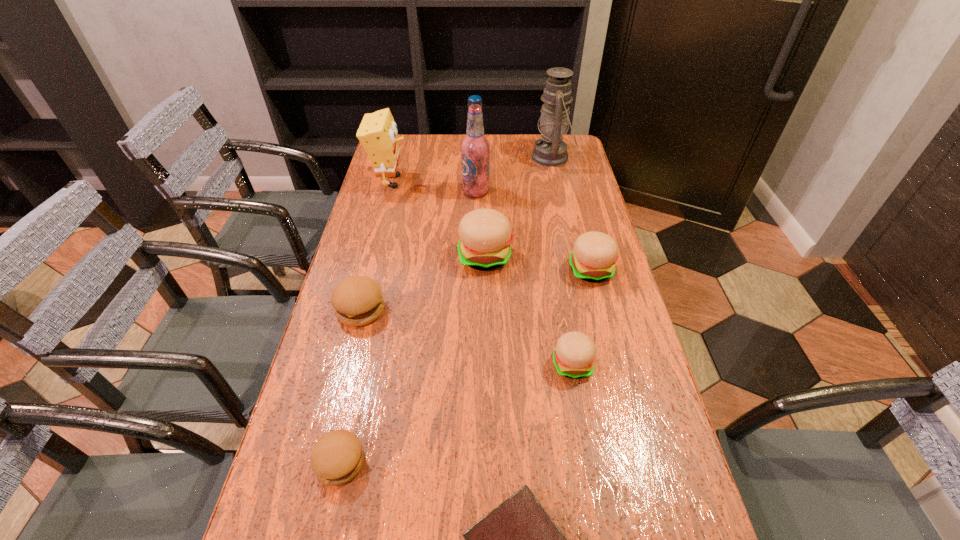
The image size is (960, 540). What are the coordinates of `oil lamp` in the screenshot? It's located at (551, 151).

Where is `alcohol`? The image size is (960, 540). alcohol is located at coordinates (475, 148).

Where is `yellow sponge`? yellow sponge is located at coordinates click(x=377, y=133).

This screenshot has width=960, height=540. Find the location of `the third tallest object`. the third tallest object is located at coordinates pos(377,133).

At what (x,y) coordinates should I click in order to perform the action: click on the biggest beige hamburger. Please return your answer as a coordinate pair (x, y). Looking at the image, I should click on (485, 235).

Locate an element on the screen. This screenshot has height=540, width=960. the third hamburger from right to left is located at coordinates (485, 235).

This screenshot has height=540, width=960. I want to click on the fifth tallest object, so click(x=594, y=254).

You are a GUI agent. You are given a task and a screenshot of the screen. Output one action in this format:
    pyautogui.click(x=<x>, y=<y>)
    Task: Click on the fourth shortest hamburger
    The height and width of the screenshot is (540, 960).
    Given the screenshot: What is the action you would take?
    pyautogui.click(x=594, y=254)

Where is `the fourth nearest object`? The width and height of the screenshot is (960, 540). the fourth nearest object is located at coordinates click(x=357, y=301).

The width and height of the screenshot is (960, 540). What are the coordinates of `the third nearest hamburger` in the screenshot? It's located at (357, 301).